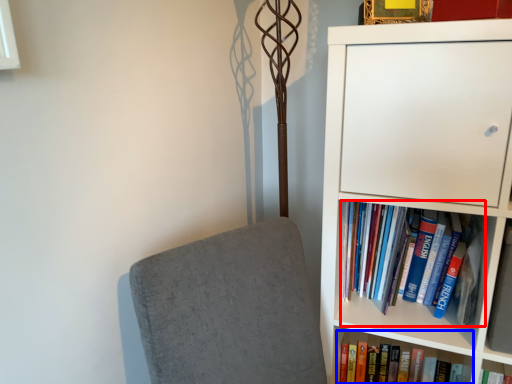
Question: Which object appears closest to the camera in this image, book (highlighted by a red box) or book (highlighted by a blue box)?

Choices:
 (A) book
 (B) book

Answer: (A)